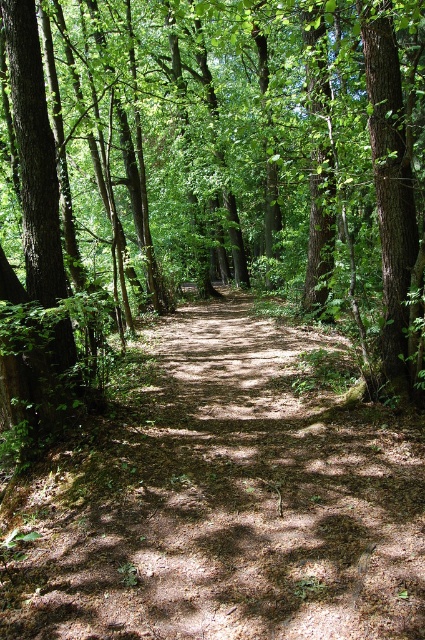
Question: Which object is closer to the camera taking this photo?

Choices:
 (A) dirt path at center
 (B) brown textured tree at center

Answer: (A)

Question: Does brown textured tree at center appear on the right side of dirt path at center?

Choices:
 (A) yes
 (B) no

Answer: (A)

Question: Which of the following is the farthest from the observer?

Choices:
 (A) brown textured tree at center
 (B) dirt path at center

Answer: (A)

Question: Does brown textured tree at center have a smaller size compared to dirt path at center?

Choices:
 (A) yes
 (B) no

Answer: (B)

Question: Does brown textured tree at center appear over dirt path at center?

Choices:
 (A) no
 (B) yes

Answer: (B)